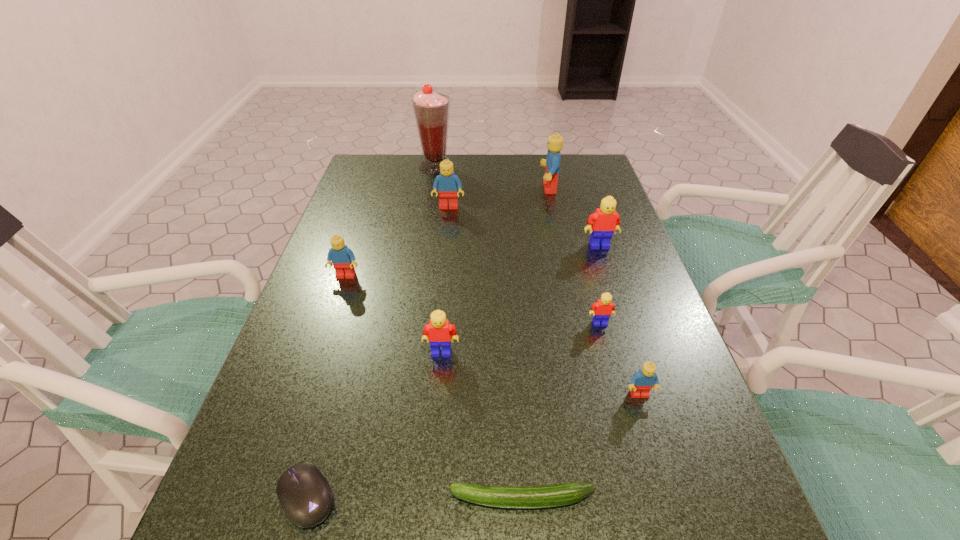
At what (x,y) coordinates should I click in order to perform the action: click on vacant space that is in between the nearest yellow Lego and the red smoothie. Please return your answer as a coordinate pair (x, y). Looking at the image, I should click on (439, 260).

Where is `vacant region between the farthest object and the leftmost blue Lego`? This screenshot has height=540, width=960. vacant region between the farthest object and the leftmost blue Lego is located at coordinates (391, 221).

Choose which object is the sixth nearest neighbor to the sixth nearest Lego. Please provide its 2D coordinates. Your answer should be formatted as a tuple, i.e. [(x, y)], where the tuple contains the x and y coordinates of a point satisfying the conditions above.

[(602, 310)]

Select which object appears as the second closest to the second biggest blue Lego. Please provide its 2D coordinates. Your answer should be formatted as a tuple, i.e. [(x, y)], where the tuple contains the x and y coordinates of a point satisfying the conditions above.

[(555, 142)]

Identify which Lego is located as the fifth nearest to the leftmost blue Lego. Please provide its 2D coordinates. Your answer should be formatted as a tuple, i.e. [(x, y)], where the tuple contains the x and y coordinates of a point satisfying the conditions above.

[(555, 142)]

Where is `Lego that stands as the fifth closest to the farthest yellow Lego`? This screenshot has width=960, height=540. Lego that stands as the fifth closest to the farthest yellow Lego is located at coordinates (438, 332).

Identify which blue Lego is the fourth nearest to the second shortest object. Please provide its 2D coordinates. Your answer should be formatted as a tuple, i.e. [(x, y)], where the tuple contains the x and y coordinates of a point satisfying the conditions above.

[(555, 142)]

Locate which blue Lego ranks in proximity to the tallest object. Please provide its 2D coordinates. Your answer should be formatted as a tuple, i.e. [(x, y)], where the tuple contains the x and y coordinates of a point satisfying the conditions above.

[(447, 183)]

Select which yellow Lego is the closest to the shortest object. Please provide its 2D coordinates. Your answer should be formatted as a tuple, i.e. [(x, y)], where the tuple contains the x and y coordinates of a point satisfying the conditions above.

[(438, 332)]

Identify which yellow Lego is the third closest to the shortest object. Please provide its 2D coordinates. Your answer should be formatted as a tuple, i.e. [(x, y)], where the tuple contains the x and y coordinates of a point satisfying the conditions above.

[(604, 222)]